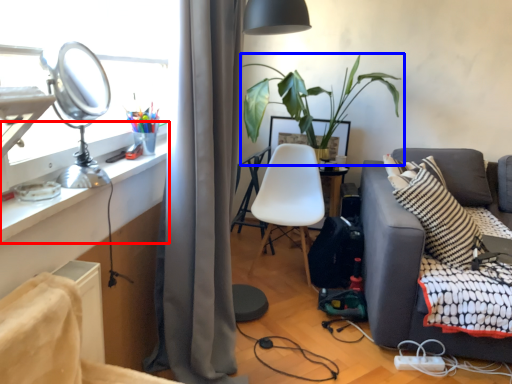
Question: Which point is closer to the camera, desk (highlighted by a red box) or houseplant (highlighted by a blue box)?

Choices:
 (A) desk
 (B) houseplant

Answer: (A)